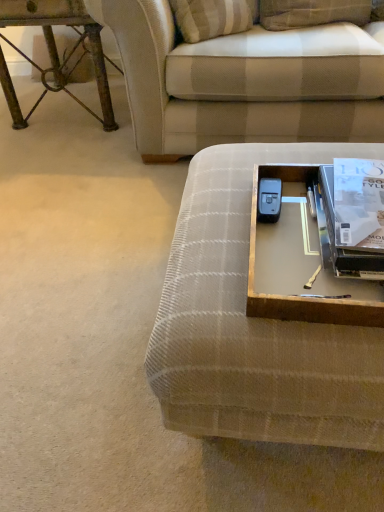
Question: In which direction should I rotate to look at plaid fabric couch at upper center, which ranks as the 1th studio couch in back-to-front order?

Choices:
 (A) right
 (B) left

Answer: (A)

Question: Is plaid fabric studio couch at center, the second studio couch in the top-to-bottom sequence, turned away from plaid fabric couch at upper center, which ranks as the 1th studio couch in back-to-front order?

Choices:
 (A) no
 (B) yes

Answer: (B)

Question: Is plaid fabric studio couch at center, placed as the first studio couch when sorted from bottom to top, thinner than plaid fabric couch at upper center, which is counted as the second studio couch, starting from the bottom?

Choices:
 (A) no
 (B) yes

Answer: (B)

Question: From a real-world perspective, does plaid fabric studio couch at center, placed as the first studio couch when sorted from bottom to top, stand above plaid fabric couch at upper center, which is counted as the first studio couch, starting from the top?

Choices:
 (A) no
 (B) yes

Answer: (A)

Question: Is plaid fabric studio couch at center, placed as the first studio couch when sorted from bottom to top, far away from plaid fabric couch at upper center, which is counted as the first studio couch, starting from the top?

Choices:
 (A) yes
 (B) no

Answer: (B)

Question: Is plaid fabric studio couch at center, placed as the first studio couch when sorted from bottom to top, further to the viewer compared to plaid fabric couch at upper center, which ranks as the 1th studio couch in back-to-front order?

Choices:
 (A) yes
 (B) no

Answer: (B)

Question: From the image's perspective, is plaid fabric studio couch at center, the second studio couch in the top-to-bottom sequence, under plaid fabric couch at upper center, which is counted as the second studio couch, starting from the bottom?

Choices:
 (A) yes
 (B) no

Answer: (A)

Question: Can you confirm if plaid fabric studio couch at center, placed as the second studio couch when sorted from back to front, is thinner than metallic silver tray at lower right?

Choices:
 (A) no
 (B) yes

Answer: (A)

Question: Does plaid fabric studio couch at center, the second studio couch in the top-to-bottom sequence, come behind metallic silver tray at lower right?

Choices:
 (A) no
 (B) yes

Answer: (A)

Question: From the image's perspective, is plaid fabric studio couch at center, the second studio couch in the top-to-bottom sequence, located beneath metallic silver tray at lower right?

Choices:
 (A) no
 (B) yes

Answer: (B)

Question: Is plaid fabric studio couch at center, placed as the second studio couch when sorted from back to front, closer to the viewer compared to metallic silver tray at lower right?

Choices:
 (A) no
 (B) yes

Answer: (B)

Question: Can you confirm if plaid fabric studio couch at center, the 1th studio couch when ordered from front to back, is wider than metallic silver tray at lower right?

Choices:
 (A) yes
 (B) no

Answer: (A)

Question: From a real-world perspective, is plaid fabric studio couch at center, placed as the first studio couch when sorted from bottom to top, over metallic silver tray at lower right?

Choices:
 (A) yes
 (B) no

Answer: (B)

Question: Is metallic silver tray at lower right not inside plaid fabric couch at upper center, which ranks as the 1th studio couch in back-to-front order?

Choices:
 (A) no
 (B) yes

Answer: (B)